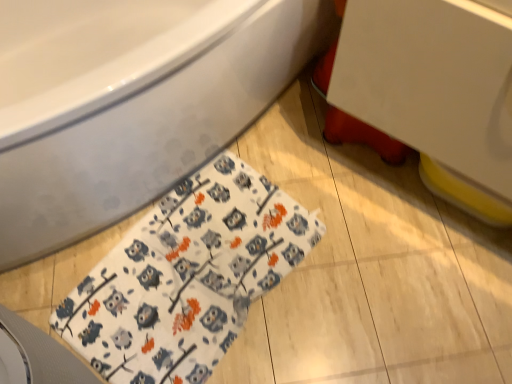
Question: Does white glossy sink at upper right have a smaller size compared to white fabric with owl pattern at lower left?

Choices:
 (A) yes
 (B) no

Answer: (B)

Question: From the image's perspective, does white glossy sink at upper right appear lower than white fabric with owl pattern at lower left?

Choices:
 (A) yes
 (B) no

Answer: (B)

Question: Does white glossy sink at upper right lie behind white fabric with owl pattern at lower left?

Choices:
 (A) no
 (B) yes

Answer: (A)

Question: Does white glossy sink at upper right have a greater height compared to white fabric with owl pattern at lower left?

Choices:
 (A) yes
 (B) no

Answer: (A)

Question: Is white glossy sink at upper right touching white fabric with owl pattern at lower left?

Choices:
 (A) no
 (B) yes

Answer: (A)

Question: Does white glossy sink at upper right have a greater width compared to white fabric with owl pattern at lower left?

Choices:
 (A) yes
 (B) no

Answer: (B)

Question: Is white glossy sink at upper right at the left side of white glossy bathtub at upper left?

Choices:
 (A) yes
 (B) no

Answer: (B)

Question: From a real-world perspective, is white glossy sink at upper right physically below white glossy bathtub at upper left?

Choices:
 (A) yes
 (B) no

Answer: (B)

Question: Is white glossy sink at upper right outside white glossy bathtub at upper left?

Choices:
 (A) yes
 (B) no

Answer: (A)

Question: From the image's perspective, does white glossy sink at upper right appear higher than white glossy bathtub at upper left?

Choices:
 (A) no
 (B) yes

Answer: (A)

Question: Does white glossy sink at upper right have a greater height compared to white glossy bathtub at upper left?

Choices:
 (A) no
 (B) yes

Answer: (A)

Question: Is white glossy sink at upper right wider than white glossy bathtub at upper left?

Choices:
 (A) no
 (B) yes

Answer: (A)

Question: Can you confirm if white fabric with owl pattern at lower left is wider than white glossy sink at upper right?

Choices:
 (A) no
 (B) yes

Answer: (B)